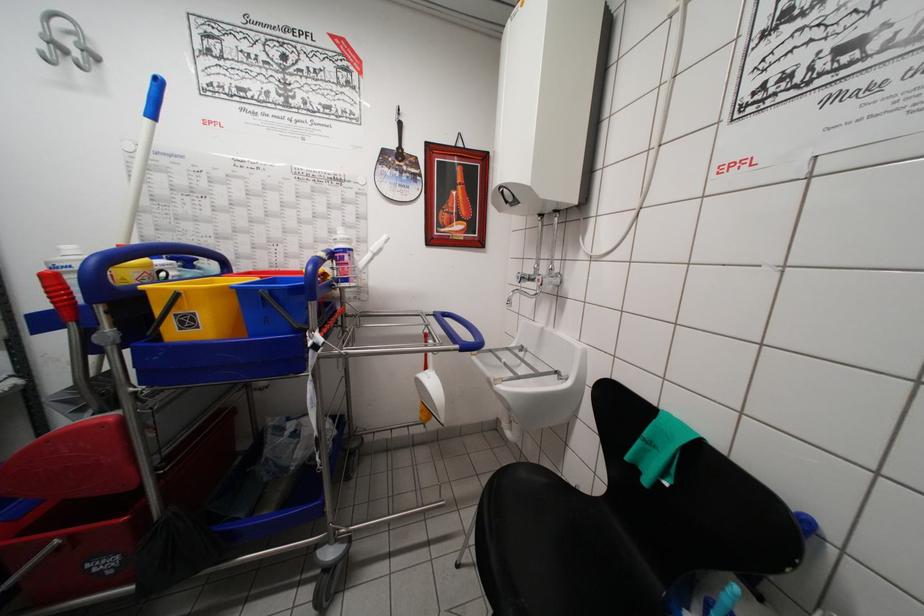
The width and height of the screenshot is (924, 616). In order to click on chair sitting surface in this screenshot , I will do `click(569, 539)`.